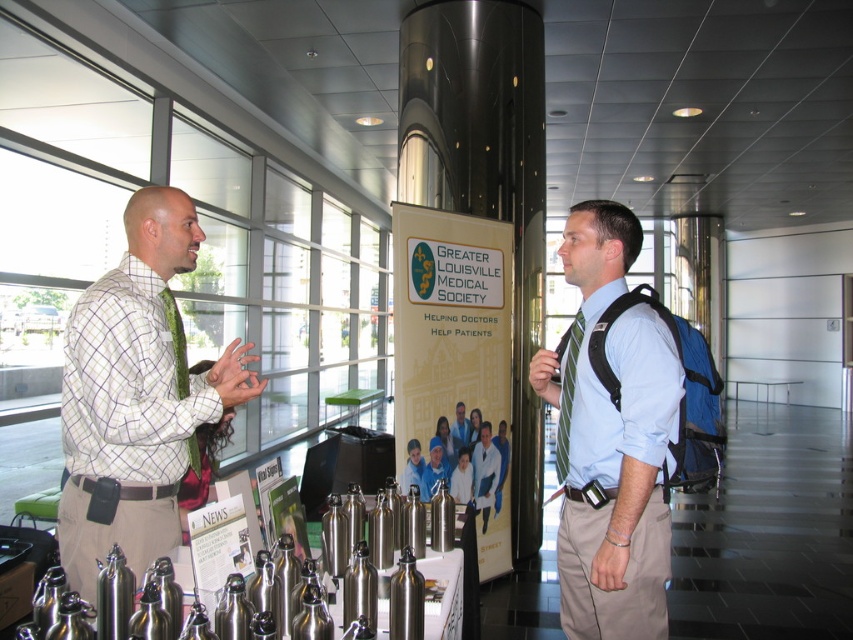
In the scene shown: You are organizing a conference and need to ensure that the yellow paper poster at center is visible to all attendees. Since the light blue shirt at center is in the way, can you determine if the poster is wider than the shirt to ensure visibility?

The yellow paper poster at center might be wider than light blue shirt at center, so there is a possibility that the poster is wide enough to be visible despite the shirt being in front.